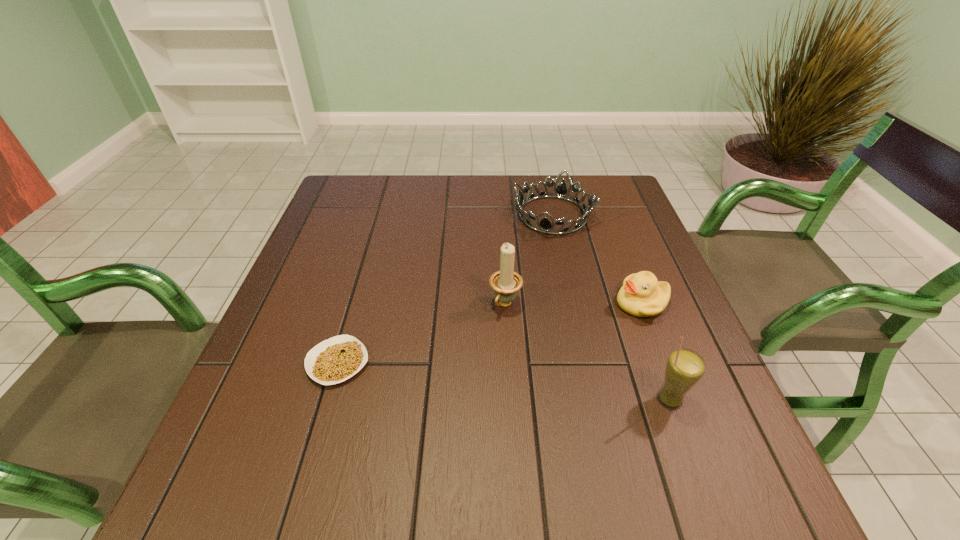
At what (x,y) coordinates should I click in order to perform the action: click on straw for drinking that is at the right edge. Please return your answer as a coordinate pair (x, y). This screenshot has height=540, width=960. Looking at the image, I should click on (685, 367).

This screenshot has width=960, height=540. I want to click on duckling located in the right edge section of the desktop, so click(642, 295).

This screenshot has width=960, height=540. Identify the location of tiara at the right edge. (545, 225).

What are the coordinates of `object at the far right corner` in the screenshot? It's located at (545, 225).

The image size is (960, 540). In order to click on object situated at the near right corner in this screenshot , I will do `click(685, 367)`.

At what (x,y) coordinates should I click in order to perform the action: click on vacant space at the far edge of the desktop. Please return your answer as a coordinate pair (x, y). The image size is (960, 540). Looking at the image, I should click on (412, 178).

You are a GUI agent. You are given a task and a screenshot of the screen. Output one action in this format:
    pyautogui.click(x=<x>, y=<y>)
    Task: Click on the vacant space at the near edge
    
    Given the screenshot: What is the action you would take?
    pyautogui.click(x=508, y=443)

The width and height of the screenshot is (960, 540). Find the location of `vacant space at the left edge of the desktop`. vacant space at the left edge of the desktop is located at coordinates (339, 279).

This screenshot has height=540, width=960. In the image, there is a desktop. Identify the location of vacant region at the right edge. (642, 224).

I want to click on free space at the far left corner of the desktop, so click(x=337, y=201).